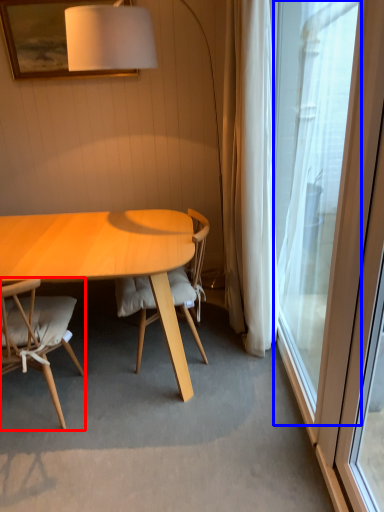
Question: Which object is further to the camera taking this photo, chair (highlighted by a red box) or window (highlighted by a blue box)?

Choices:
 (A) chair
 (B) window

Answer: (A)